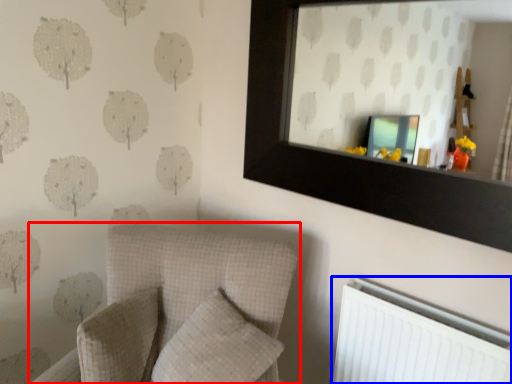
Question: Which of the following is the closest to the observer, furniture (highlighted by a red box) or radiator (highlighted by a blue box)?

Choices:
 (A) furniture
 (B) radiator

Answer: (A)